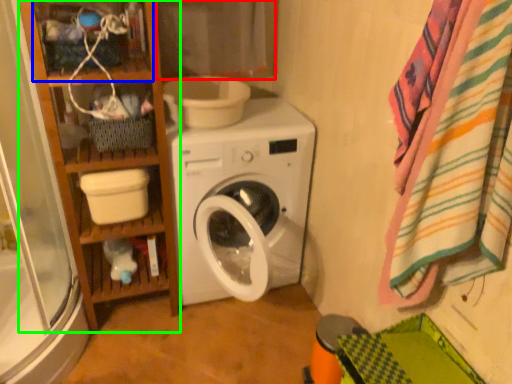
Question: Considering the real-world distances, which object is closest to curtain (highlighted by a red box)? shelf (highlighted by a blue box) or bookshelf (highlighted by a green box).

Choices:
 (A) shelf
 (B) bookshelf

Answer: (A)